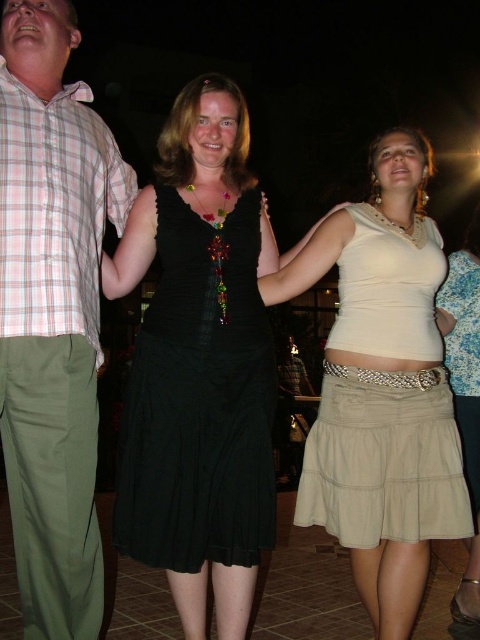
Question: Is plaid cotton shirt at left positioned at the back of black satin dress at center?

Choices:
 (A) yes
 (B) no

Answer: (B)

Question: Is plaid cotton shirt at left further to camera compared to pink plaid shirt at left?

Choices:
 (A) no
 (B) yes

Answer: (B)

Question: Which of the following is the farthest from the observer?

Choices:
 (A) (20, 140)
 (B) (452, 492)
 (C) (12, 102)

Answer: (B)

Question: Observing the image, what is the correct spatial positioning of plaid cotton shirt at left in reference to black satin dress at center?

Choices:
 (A) left
 (B) right

Answer: (A)

Question: Which of the following is the farthest from the observer?

Choices:
 (A) beige fabric skirt at center
 (B) beige cotton skirt at lower right

Answer: (B)

Question: Estimate the real-world distances between objects in this image. Which object is closer to the beige fabric skirt at center?

Choices:
 (A) plaid cotton shirt at left
 (B) black satin dress at center
 (C) pink plaid shirt at left

Answer: (B)